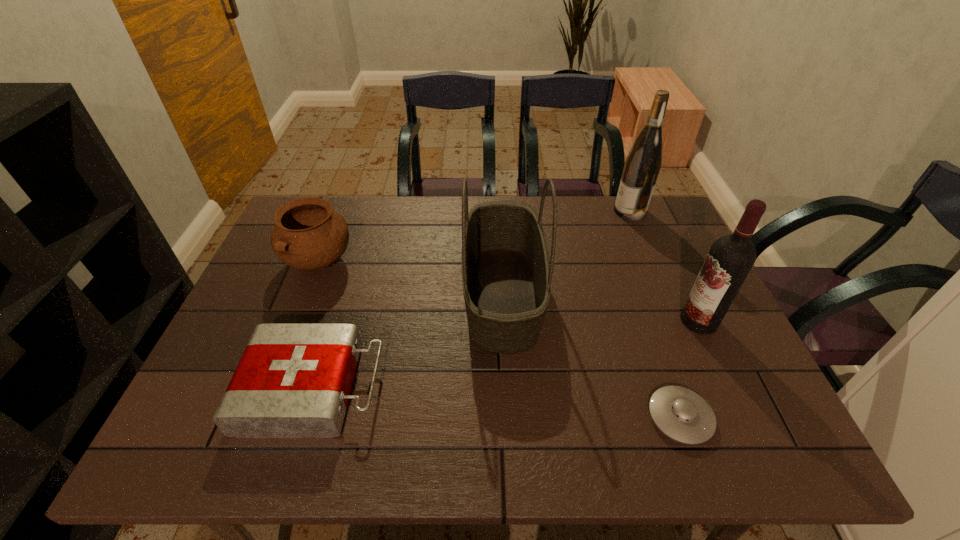
At what (x,y) coordinates should I click in order to perform the action: click on vacant space at the far right corner. Please return your answer as a coordinate pair (x, y). Image resolution: width=960 pixels, height=540 pixels. Looking at the image, I should click on (666, 233).

Where is `free space between the nearer wine bottle and the fifth tallest object`? The width and height of the screenshot is (960, 540). free space between the nearer wine bottle and the fifth tallest object is located at coordinates (506, 354).

Where is `empty space between the nearer wine bottle and the farthest object`? Image resolution: width=960 pixels, height=540 pixels. empty space between the nearer wine bottle and the farthest object is located at coordinates (664, 266).

This screenshot has width=960, height=540. I want to click on vacant area that lies between the nearer wine bottle and the fourth object from right to left, so click(x=601, y=307).

Locate an element on the screen. The height and width of the screenshot is (540, 960). free space between the first-aid kit and the fourth object from right to left is located at coordinates (408, 341).

The width and height of the screenshot is (960, 540). I want to click on blank region between the nearer wine bottle and the third object from left to right, so click(x=601, y=307).

Find the location of a particular element. Image resolution: width=960 pixels, height=540 pixels. vacant space that is in between the farthest object and the nearer wine bottle is located at coordinates (664, 266).

The image size is (960, 540). I want to click on free spot between the basket and the farther wine bottle, so click(x=566, y=253).

This screenshot has width=960, height=540. I want to click on free space that is in between the farthest object and the nearer wine bottle, so click(664, 266).

Where is `the fifth closest object relative to the pottery`? the fifth closest object relative to the pottery is located at coordinates (731, 257).